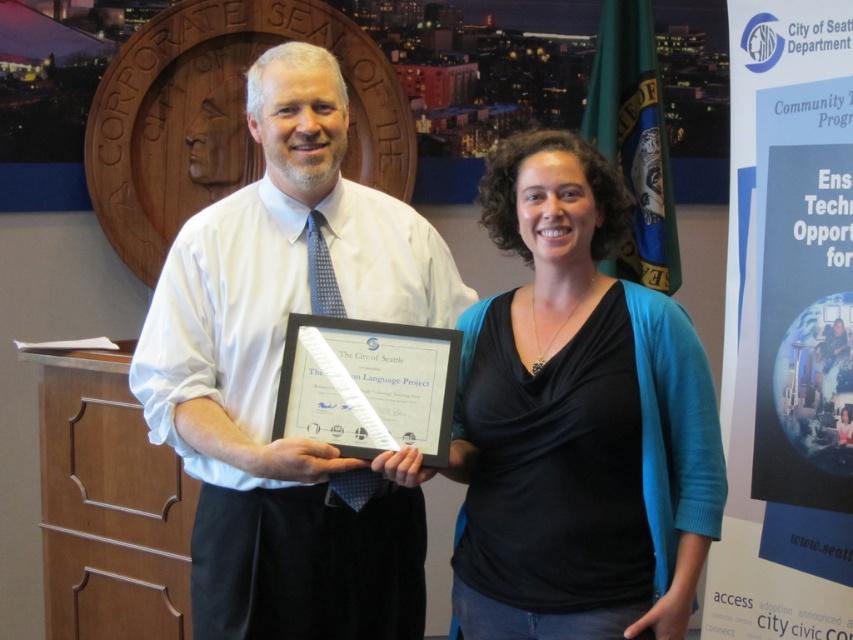
You are an event planner organizing a certificate presentation. You have a black matte card at center and a beech wood drawer at lower left. Which object should you place the certificate on to ensure it is visible to the audience?

The black matte card at center should be used because it is wider than the beech wood drawer at lower left, making it more visible to the audience.

You are an event photographer at the Seattle City Hall. You need to capture a photo of both the white paper at center and the wooden at left in the frame. Which object should you position closer to the camera to ensure both are fully visible?

The white paper at center is not as tall as wooden at left, so you should position the white paper at center closer to the camera to ensure both are fully visible.